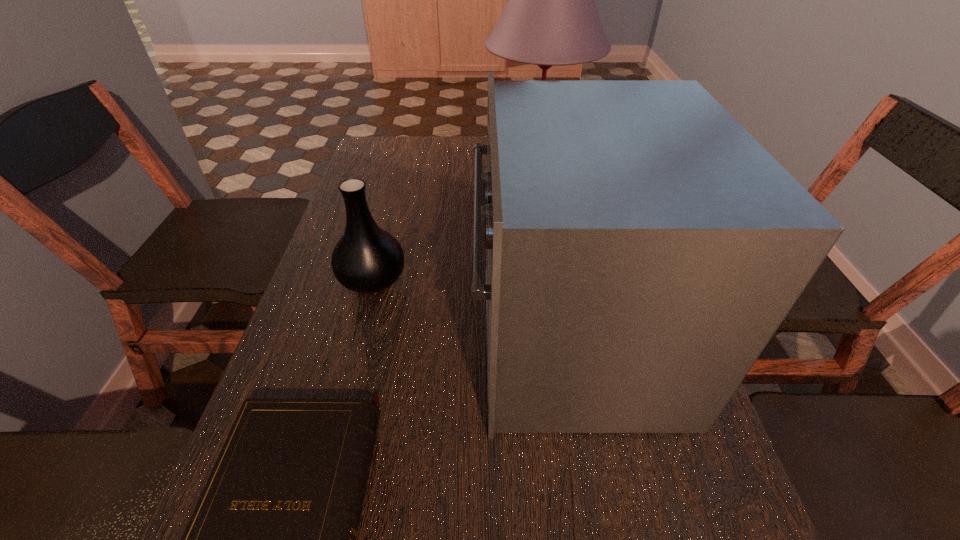
The image size is (960, 540). I want to click on empty space between the third tallest object and the toaster oven, so click(x=471, y=307).

Locate an element on the screen. The height and width of the screenshot is (540, 960). vacant space that is in between the second tallest object and the third tallest object is located at coordinates (471, 307).

This screenshot has height=540, width=960. In order to click on vacant area that lies between the second shortest object and the toaster oven in this screenshot , I will do `click(471, 307)`.

The image size is (960, 540). In order to click on object that stands as the closest to the table lamp in this screenshot , I will do [x=642, y=248].

You are a GUI agent. You are given a task and a screenshot of the screen. Output one action in this format:
    pyautogui.click(x=<x>, y=<y>)
    Task: Click on the object that can be found as the third closest to the vase
    
    Given the screenshot: What is the action you would take?
    pyautogui.click(x=550, y=19)